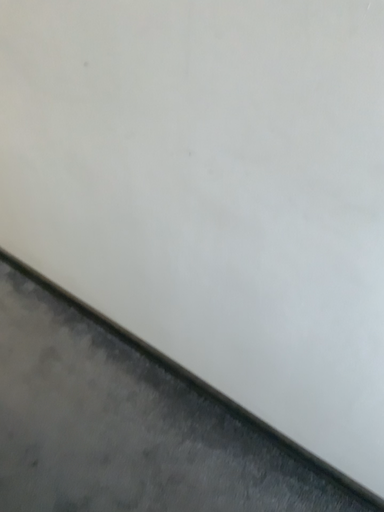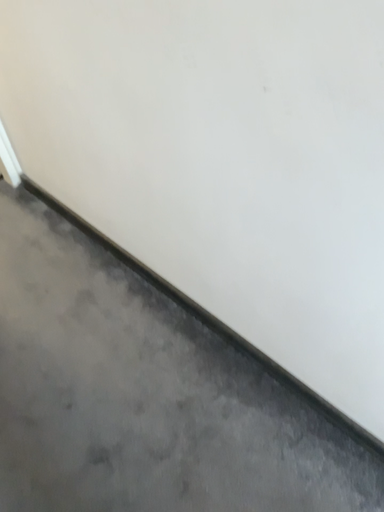
Question: Which way did the camera rotate in the video?

Choices:
 (A) rotated downward
 (B) rotated upward

Answer: (A)